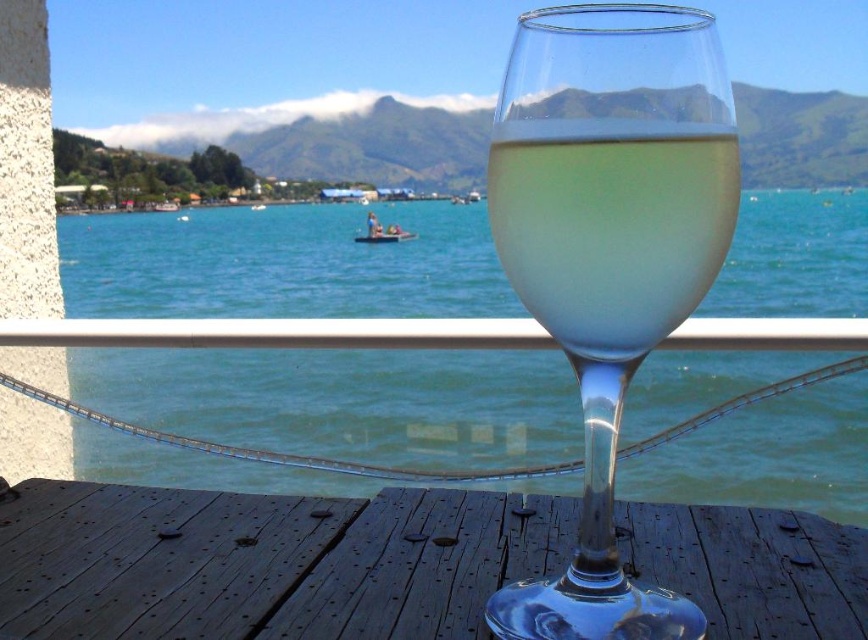
Does transparent glass at center appear on the right side of clear glass wine glass at center?

No, transparent glass at center is not to the right of clear glass wine glass at center.

Who is more distant from viewer, (725, 572) or (610, 449)?

Point (725, 572)

The width and height of the screenshot is (868, 640). What are the coordinates of `transparent glass at center` in the screenshot? It's located at (262, 563).

Which is more to the right, transparent water at center or translucent glass wine at center?

translucent glass wine at center is more to the right.

In the scene shown: Who is more forward, (819, 486) or (676, 275)?

Positioned in front is point (676, 275).

Is point (513, 365) closer to camera compared to point (574, 305)?

No, it is behind (574, 305).

You are a GUI agent. You are given a task and a screenshot of the screen. Output one action in this format:
    pyautogui.click(x=<x>, y=<y>)
    Task: Click on the transparent water at center
    The height and width of the screenshot is (640, 868).
    Given the screenshot: What is the action you would take?
    coord(347,401)

Consider the image. Is clear glass wine glass at center above translucent glass wine at center?

No, clear glass wine glass at center is not above translucent glass wine at center.

Can you confirm if clear glass wine glass at center is positioned below translucent glass wine at center?

Yes.

Which is in front, point (617, 132) or point (635, 188)?

Point (635, 188)

Identify the location of clear glass wine glass at center. (608, 252).